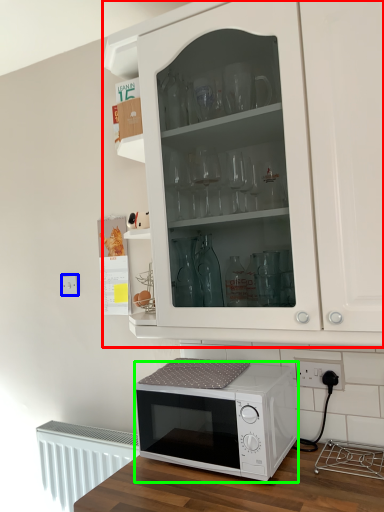
Question: Which object is positioned closest to cabinetry (highlighted by a red box)? Select from electric outlet (highlighted by a blue box) and microwave oven (highlighted by a green box).

Choices:
 (A) electric outlet
 (B) microwave oven

Answer: (B)